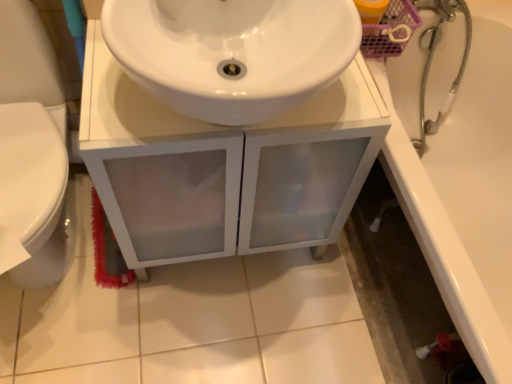
Where is `vacant area located to the right-hand side of white frosted glass cabinet at center`? vacant area located to the right-hand side of white frosted glass cabinet at center is located at coordinates (362, 289).